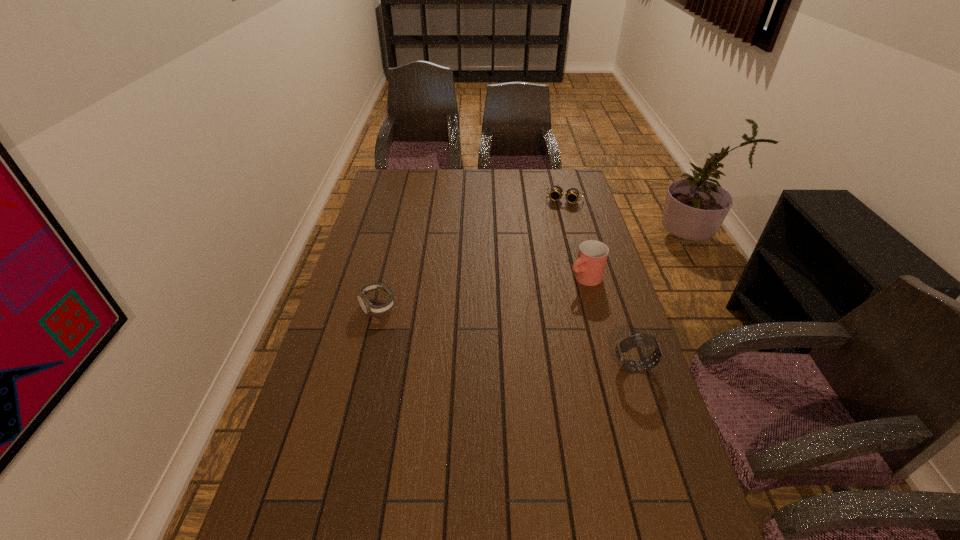
You are a GUI agent. You are given a task and a screenshot of the screen. Output one action in this format:
    pyautogui.click(x=<x>, y=<y>)
    Task: Click on the vacant point located between the shortest object and the farther watch
    This screenshot has height=540, width=960.
    Given the screenshot: What is the action you would take?
    pyautogui.click(x=471, y=253)

What are the coordinates of `empty space between the cup and the left watch` in the screenshot? It's located at (481, 292).

Where is `vacant area between the nearer watch and the cup`? vacant area between the nearer watch and the cup is located at coordinates (610, 322).

Where is `empty space that is in between the goggles and the cup`? This screenshot has width=960, height=540. empty space that is in between the goggles and the cup is located at coordinates (575, 239).

At what (x,y) coordinates should I click in order to perform the action: click on unoccupied position between the left watch and the taller watch. Please return your answer as a coordinate pair (x, y). The height and width of the screenshot is (540, 960). Looking at the image, I should click on (506, 336).

Find the location of `vacant point located between the cup and the farthest object`. vacant point located between the cup and the farthest object is located at coordinates (575, 239).

The height and width of the screenshot is (540, 960). Find the location of `object that is the second closest one to the cup`. object that is the second closest one to the cup is located at coordinates (556, 192).

Locate which object is the second closest to the left watch. Please provide its 2D coordinates. Your answer should be formatted as a tuple, i.e. [(x, y)], where the tuple contains the x and y coordinates of a point satisfying the conditions above.

[(622, 347)]

Where is `free space that satisfies the following two spatial constraints: 1. on the face of the leftmost object; 2. on the face of the right watch`? This screenshot has height=540, width=960. free space that satisfies the following two spatial constraints: 1. on the face of the leftmost object; 2. on the face of the right watch is located at coordinates (363, 367).

Find the location of a particular element. The image size is (960, 540). vacant space that satisfies the following two spatial constraints: 1. on the face of the taller watch; 2. on the face of the third farthest object is located at coordinates (363, 367).